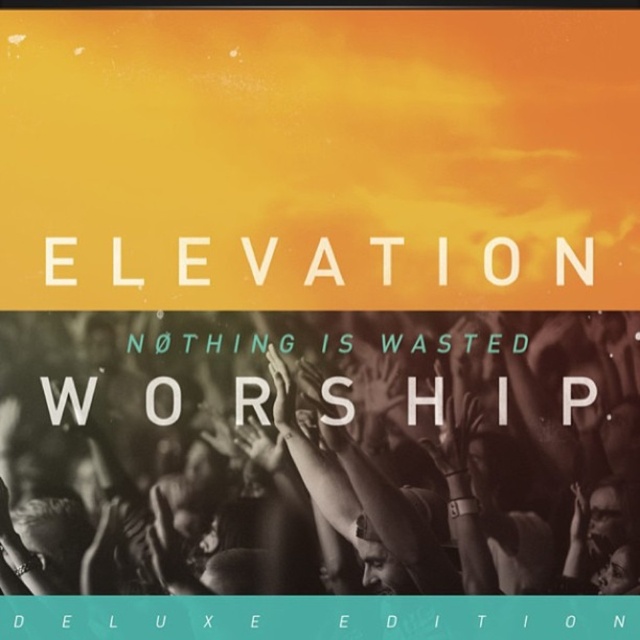
Based on the scene description, where exactly is the black matte hands at center located in the image?

The black matte hands at center is located at point (337, 444).